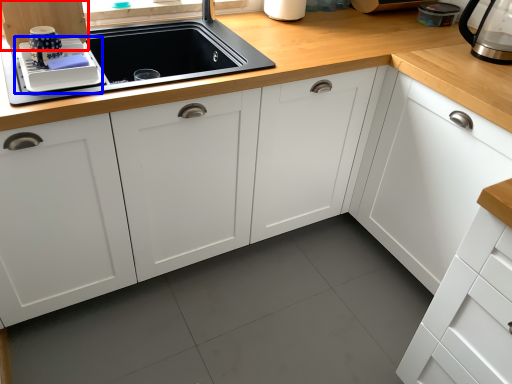
Question: Among these objects, which one is farthest to the camera, cabinetry (highlighted by a red box) or appliance (highlighted by a blue box)?

Choices:
 (A) cabinetry
 (B) appliance

Answer: (B)